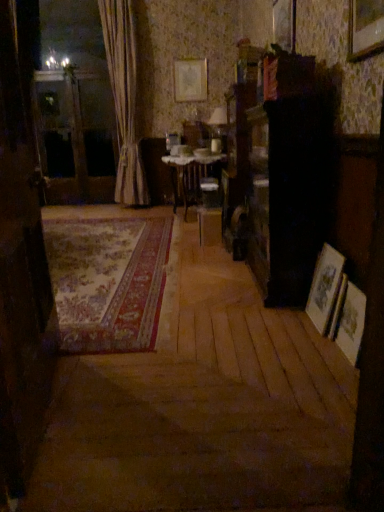
Question: From a real-world perspective, is wooden picture frame at right, the second picture frame from the front, positioned above or below wooden picture frame at lower right, the 1th picture frame in the bottom-to-top sequence?

Choices:
 (A) above
 (B) below

Answer: (A)

Question: Is wooden picture frame at right, which is the 3th picture frame from back to front, in front of or behind wooden picture frame at lower right, placed as the 1th picture frame when sorted from front to back, in the image?

Choices:
 (A) front
 (B) behind

Answer: (B)

Question: Which object is positioned farthest from the transparent glass screen door at left, the first screen door positioned from the left?

Choices:
 (A) transparent glass screen door at left, the second screen door viewed from the back
 (B) wooden picture frame at lower right, marked as the fourth picture frame in a top-to-bottom arrangement
 (C) matte gold picture frame at upper center, the first picture frame in the top-to-bottom sequence
 (D) white textured curtain at left
 (E) wooden picture frame at right, which is counted as the second picture frame, starting from the left

Answer: (B)

Question: Which object is the farthest from the white lace table at center?

Choices:
 (A) carpeted rug at center
 (B) wooden picture frame at upper center, positioned as the 2th picture frame in top-to-bottom order
 (C) wooden picture frame at lower right, which is the 4th picture frame in left-to-right order
 (D) wooden picture frame at right, the second picture frame from the front
 (E) white textured curtain at left

Answer: (C)